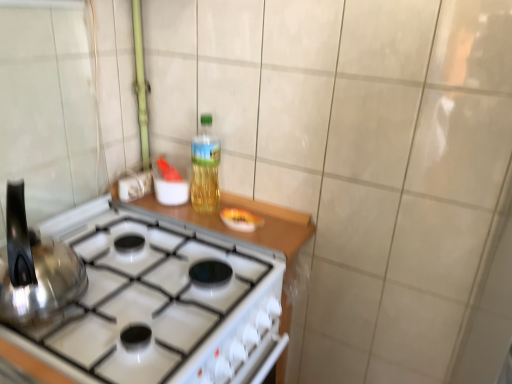
Question: Considering their positions, is satin silver kettle at left located in front of or behind white glossy gas stove at center?

Choices:
 (A) behind
 (B) front

Answer: (B)

Question: From their relative heights in the image, would you say satin silver kettle at left is taller or shorter than white glossy gas stove at center?

Choices:
 (A) short
 (B) tall

Answer: (A)

Question: Considering the real-world distances, which object is closest to the translucent plastic bottle at center?

Choices:
 (A) satin silver kettle at left
 (B) white glossy gas stove at center

Answer: (B)

Question: Based on their relative distances, which object is nearer to the satin silver kettle at left?

Choices:
 (A) translucent plastic bottle at center
 (B) white glossy gas stove at center

Answer: (B)